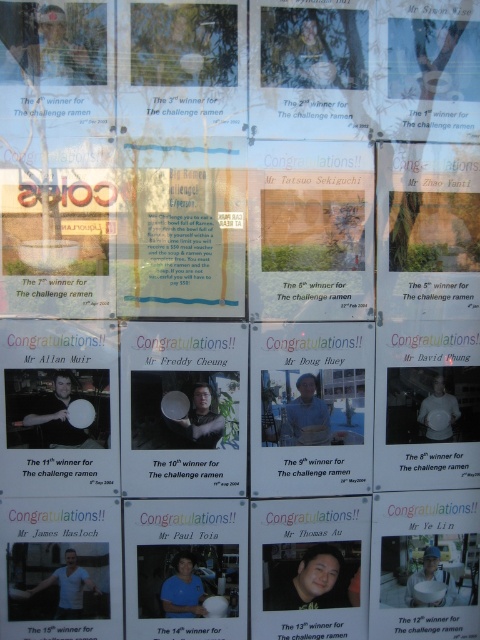
Question: Estimate the real-world distances between objects in this image. Which object is closer to the matte black laptop at upper center?

Choices:
 (A) blue denim shirt at center
 (B) matte black shirt at center
 (C) matte black frisbee at left

Answer: (A)

Question: Which is farther from the matte black frisbee at left?

Choices:
 (A) matte black plate at center
 (B) matte white shirt at center right
 (C) blue shirt at center

Answer: (B)

Question: Does matte black shirt at center have a lesser width compared to matte black frisbee at left?

Choices:
 (A) yes
 (B) no

Answer: (B)

Question: Is blue shirt at center wider than white matte t-shirt at lower left?

Choices:
 (A) yes
 (B) no

Answer: (B)

Question: Among these points, which one is farthest from the camera?

Choices:
 (A) (420, 413)
 (B) (427, 556)

Answer: (B)

Question: Is matte black shirt at center above blue shirt at center?

Choices:
 (A) yes
 (B) no

Answer: (B)